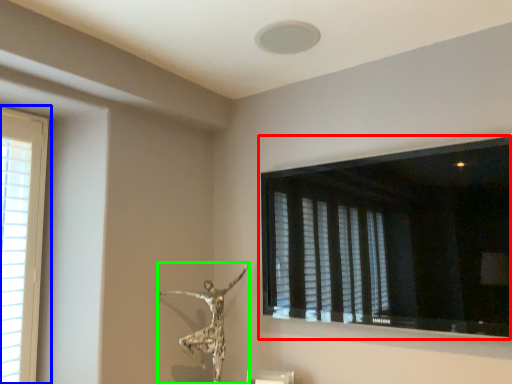
Question: Estimate the real-world distances between objects in this image. Which object is closer to window (highlighted by a red box), window (highlighted by a blue box) or sculpture (highlighted by a green box)?

Choices:
 (A) window
 (B) sculpture

Answer: (B)